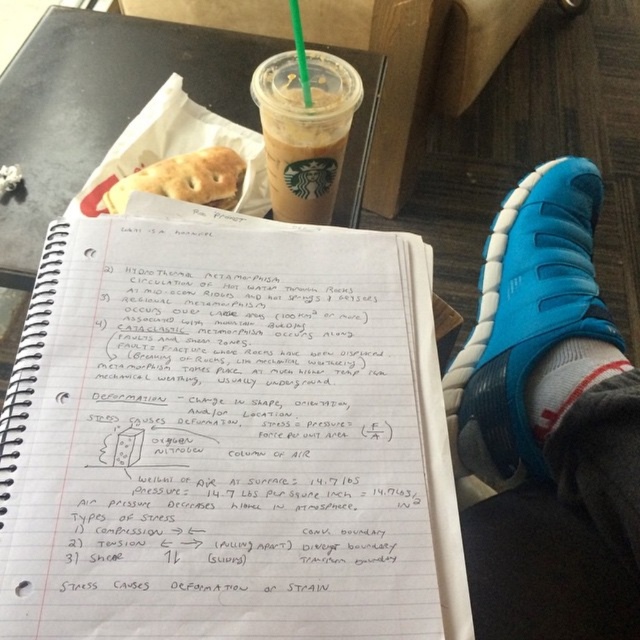
Question: Among these objects, which one is farthest from the camera?

Choices:
 (A) blue synthetic sandal at lower right
 (B) transparent plastic cup at upper center
 (C) matte brown pretzel at center
 (D) translucent plastic cup at upper center

Answer: (B)

Question: Estimate the real-world distances between objects in this image. Which object is farther from the green plastic straw at upper center?

Choices:
 (A) translucent plastic cup at upper center
 (B) matte brown pretzel at center
 (C) white paper notebook at center

Answer: (C)

Question: Does blue synthetic sandal at lower right have a larger size compared to translucent plastic cup at upper center?

Choices:
 (A) no
 (B) yes

Answer: (B)

Question: Does transparent plastic cup at upper center appear on the right side of translucent plastic cup at upper center?

Choices:
 (A) no
 (B) yes

Answer: (A)

Question: Among these points, which one is nearest to the camera?

Choices:
 (A) (140, 596)
 (B) (369, 83)

Answer: (A)

Question: Is translucent plastic cup at upper center further to camera compared to green plastic straw at upper center?

Choices:
 (A) no
 (B) yes

Answer: (A)